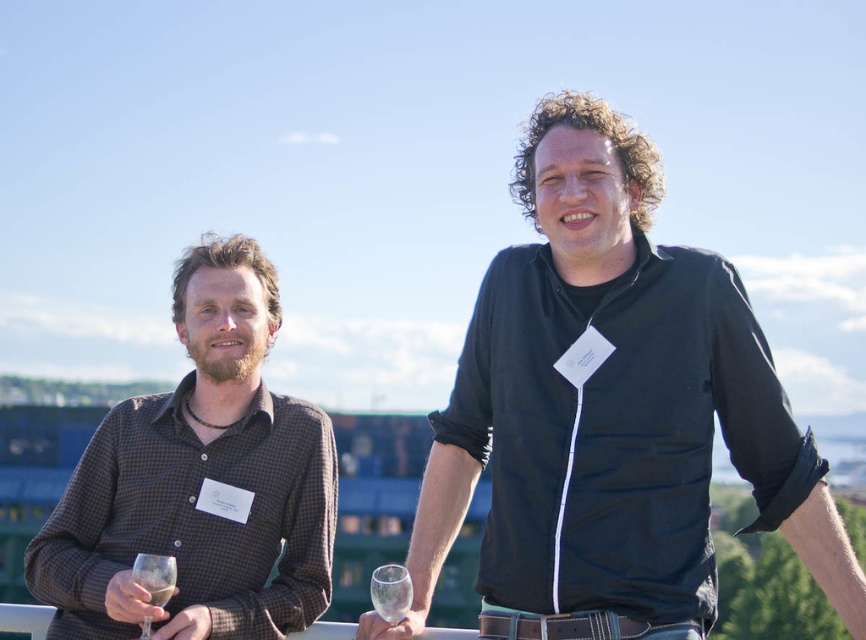
You are a photographer at a social event. You need to capture a photo of the brown checkered shirt at left and the clear glass wine glass at center. Which object is taller in the image?

The brown checkered shirt at left is taller than the clear glass wine glass at center according to the description.

You are a photographer trying to capture a clear shot of both the brown leather belt at center and the transparent glass at lower left. Which object should you focus on first to ensure it appears sharp in the photo?

You should focus on the brown leather belt at center first because it is closer to you than the transparent glass at lower left, ensuring it remains sharp while the background might blur slightly.

You are organizing a photo shoot and need to ensure that all accessories are visible in the frame. Given that the brown leather belt at center and the transparent glass at lower left are both important, which accessory should you focus on adjusting to ensure it doesn not get cropped out?

The transparent glass at lower left requires more attention because it occupies more space than the brown leather belt at center, so it is more likely to be at the edge of the frame and needs adjustment to prevent cropping.